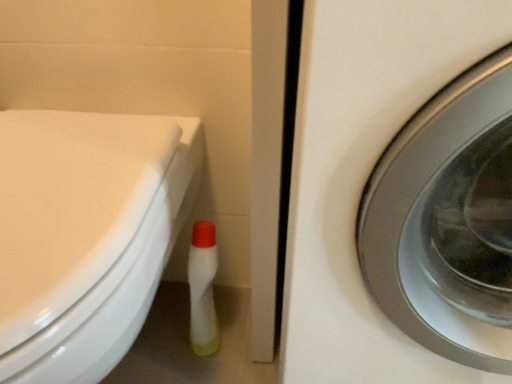
Question: Does white glossy washing machine at center right lie in front of white glossy bidet at lower left?

Choices:
 (A) yes
 (B) no

Answer: (A)

Question: Can you see white glossy washing machine at center right touching white glossy bidet at lower left?

Choices:
 (A) no
 (B) yes

Answer: (A)

Question: Is the depth of white glossy washing machine at center right greater than that of white glossy bidet at lower left?

Choices:
 (A) yes
 (B) no

Answer: (B)

Question: From the image's perspective, is white glossy washing machine at center right located beneath white glossy bidet at lower left?

Choices:
 (A) no
 (B) yes

Answer: (A)

Question: Is white glossy washing machine at center right taller than white glossy bidet at lower left?

Choices:
 (A) yes
 (B) no

Answer: (A)

Question: From a real-world perspective, is white glossy washing machine at center right physically below white glossy bidet at lower left?

Choices:
 (A) no
 (B) yes

Answer: (B)

Question: Is white glossy bidet at lower left behind white glossy washing machine at center right?

Choices:
 (A) no
 (B) yes

Answer: (B)

Question: From the image's perspective, does white glossy bidet at lower left appear lower than white glossy washing machine at center right?

Choices:
 (A) no
 (B) yes

Answer: (B)

Question: Is white glossy bidet at lower left shorter than white glossy washing machine at center right?

Choices:
 (A) yes
 (B) no

Answer: (A)

Question: Does white glossy bidet at lower left have a greater width compared to white glossy washing machine at center right?

Choices:
 (A) no
 (B) yes

Answer: (A)

Question: Can you confirm if white glossy bidet at lower left is positioned to the left of white glossy washing machine at center right?

Choices:
 (A) no
 (B) yes

Answer: (B)

Question: Is white glossy bidet at lower left at the right side of white glossy washing machine at center right?

Choices:
 (A) no
 (B) yes

Answer: (A)

Question: Relative to white glossy washing machine at center right, is white glossy bidet at lower left in front or behind?

Choices:
 (A) front
 (B) behind

Answer: (B)